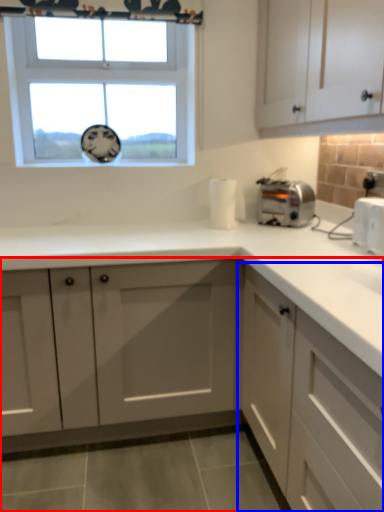
Question: Which object appears farthest to the camera in this image, cabinetry (highlighted by a red box) or cabinetry (highlighted by a blue box)?

Choices:
 (A) cabinetry
 (B) cabinetry

Answer: (A)